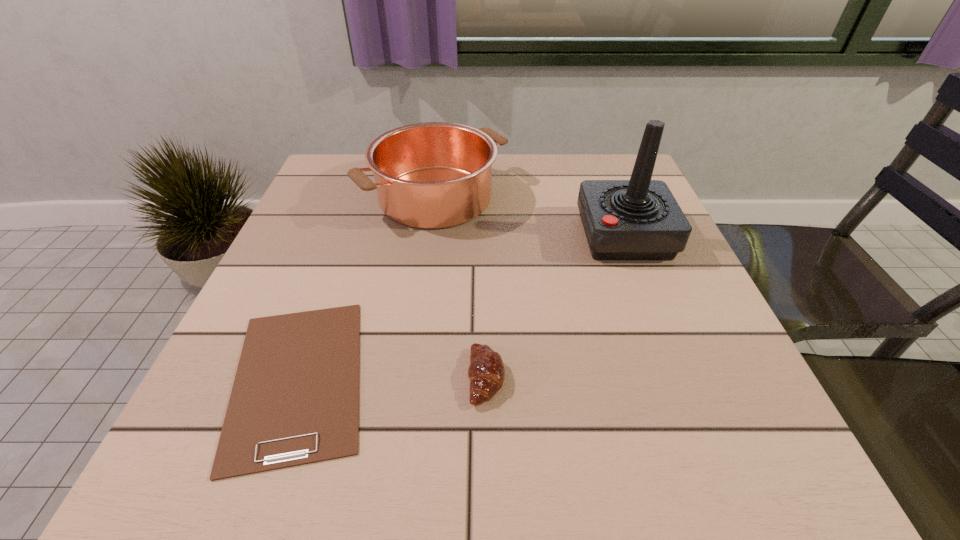
Locate an element on the screen. The width and height of the screenshot is (960, 540). empty space between the crescent roll and the saucepan is located at coordinates (461, 287).

Locate which object is the closest to the crescent roll. Please provide its 2D coordinates. Your answer should be formatted as a tuple, i.e. [(x, y)], where the tuple contains the x and y coordinates of a point satisfying the conditions above.

[(295, 398)]

What are the coordinates of `the second closest object relative to the crescent roll` in the screenshot? It's located at (638, 219).

Where is `free space in the image that satisfies the following two spatial constraints: 1. on the back side of the saucepan; 2. on the left side of the shortest object`? This screenshot has width=960, height=540. free space in the image that satisfies the following two spatial constraints: 1. on the back side of the saucepan; 2. on the left side of the shortest object is located at coordinates (362, 197).

Locate an element on the screen. The width and height of the screenshot is (960, 540). free spot that satisfies the following two spatial constraints: 1. on the back side of the saucepan; 2. on the left side of the shortest object is located at coordinates (362, 197).

Locate an element on the screen. This screenshot has width=960, height=540. blank area in the image that satisfies the following two spatial constraints: 1. on the front-facing side of the joystick; 2. on the front side of the crescent roll is located at coordinates (680, 377).

The height and width of the screenshot is (540, 960). Identify the location of free space in the image that satisfies the following two spatial constraints: 1. on the front side of the third tallest object; 2. on the left side of the second tallest object. coord(411,377).

Where is `vacant position in the image that satisfies the following two spatial constraints: 1. on the front-facing side of the rightmost object; 2. on the front side of the clipboard`? The image size is (960, 540). vacant position in the image that satisfies the following two spatial constraints: 1. on the front-facing side of the rightmost object; 2. on the front side of the clipboard is located at coordinates (681, 379).